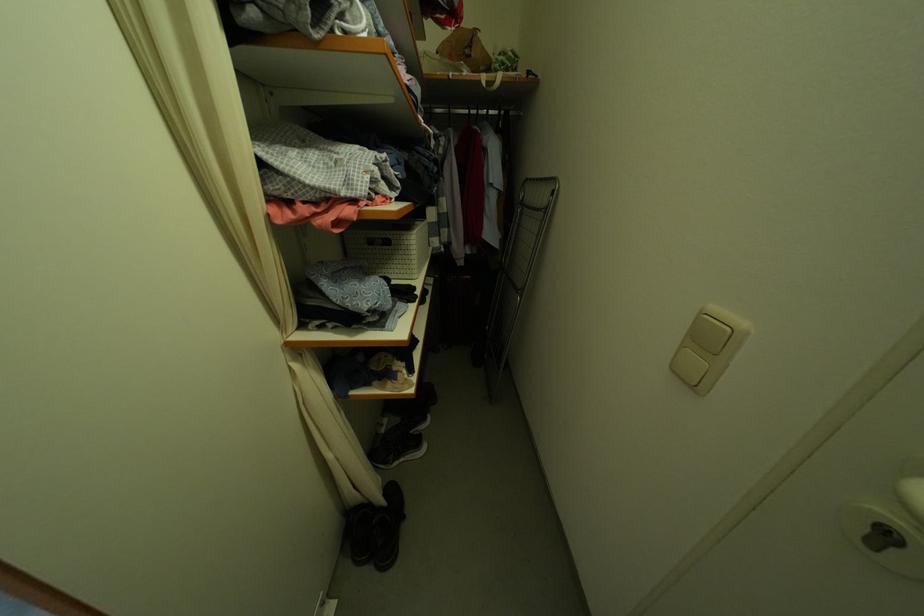
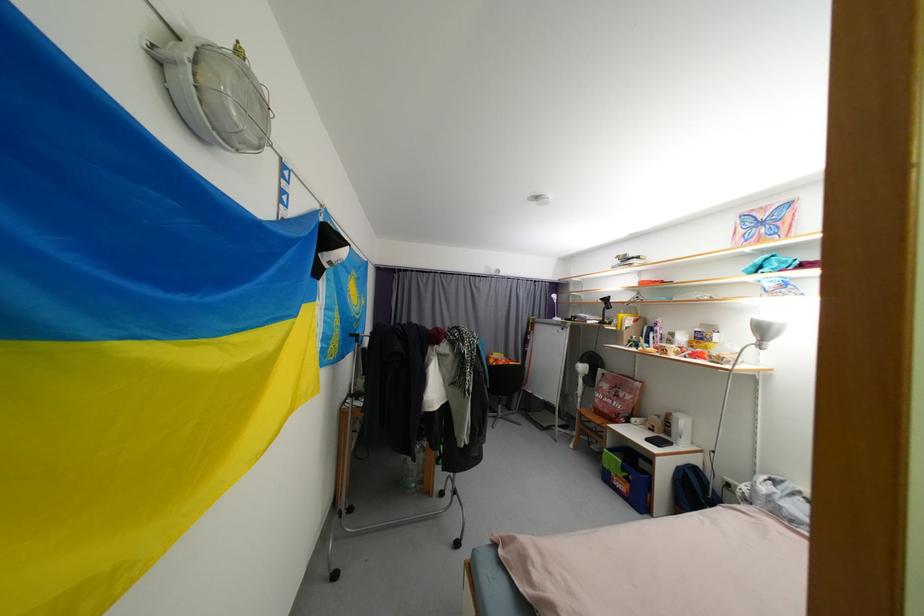
Question: The camera is either moving clockwise (left) or counter-clockwise (right) around the object. The first image is from the beginning of the video and the second image is from the end. Is the camera moving left or right when shooting the video?

Choices:
 (A) Left
 (B) Right

Answer: (B)